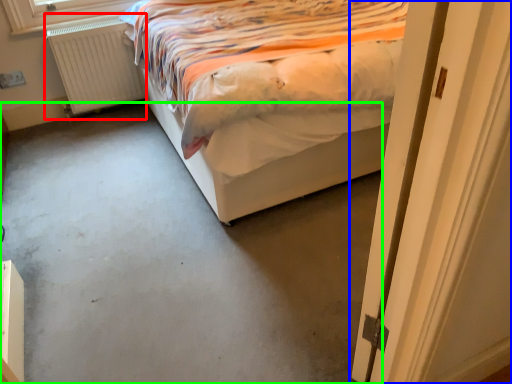
Question: Based on their relative distances, which object is nearer to radiator (highlighted by a red box)? Choose from door (highlighted by a blue box) and concrete (highlighted by a green box).

Choices:
 (A) door
 (B) concrete

Answer: (B)